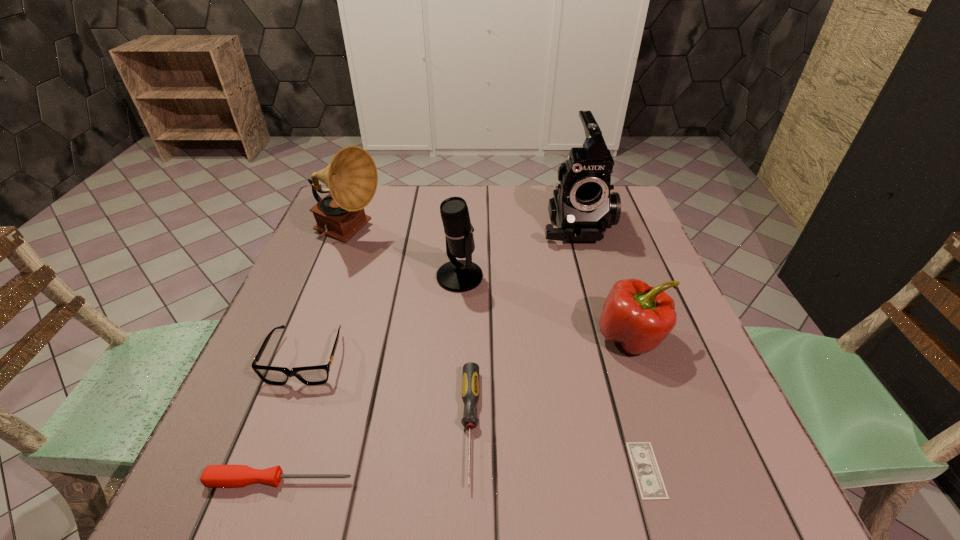
In the image, there is a desktop. At what (x,y) coordinates should I click in order to perform the action: click on blank space at the far edge. Please return your answer as a coordinate pair (x, y). Looking at the image, I should click on (540, 214).

You are a GUI agent. You are given a task and a screenshot of the screen. Output one action in this format:
    pyautogui.click(x=<x>, y=<y>)
    Task: Click on the free space at the near edge of the desktop
    This screenshot has height=540, width=960.
    Given the screenshot: What is the action you would take?
    pyautogui.click(x=355, y=511)

The image size is (960, 540). In the image, there is a desktop. What are the coordinates of `blank space at the left edge` in the screenshot? It's located at (317, 291).

Locate an element on the screen. blank space at the right edge of the desktop is located at coordinates (632, 240).

Where is `blank space at the near left corner`? Image resolution: width=960 pixels, height=540 pixels. blank space at the near left corner is located at coordinates (239, 497).

Identify the location of vacant region between the phonograph record and the sixth shortest object. This screenshot has width=960, height=540. (404, 255).

Where is `vacant space that is in between the phonograph record and the shorter screwdriver`? vacant space that is in between the phonograph record and the shorter screwdriver is located at coordinates (315, 357).

Find the location of a particular element. This screenshot has height=540, width=960. vacant space that's between the phonograph record and the money is located at coordinates (498, 352).

Find the location of `free space between the right screwdriver and the left screwdriver`. free space between the right screwdriver and the left screwdriver is located at coordinates (375, 453).

The height and width of the screenshot is (540, 960). I want to click on vacant space in between the shortest object and the camcorder, so click(611, 346).